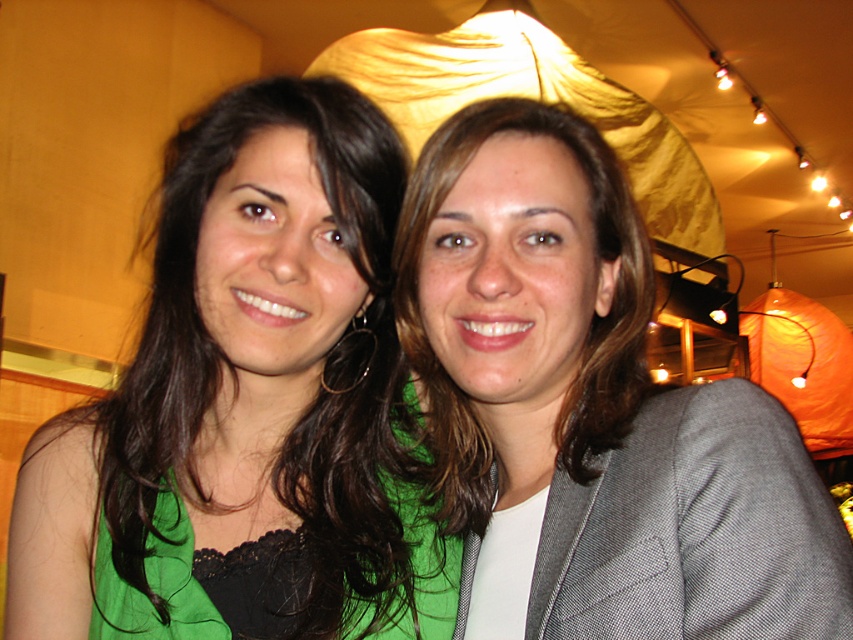
Who is more forward, (135, 355) or (587, 385)?

Point (587, 385)

Who is lower down, green fabric at left or matte gray blazer at center?

green fabric at left is lower down.

Between point (80, 588) and point (477, 481), which one is positioned in front?

Point (80, 588)

Identify the location of green fabric at left. This screenshot has height=640, width=853. (247, 406).

Can you confirm if green fabric at left is positioned to the right of green fabric jacket at upper right?

In fact, green fabric at left is to the left of green fabric jacket at upper right.

Who is lower down, green fabric at left or green fabric jacket at upper right?

green fabric jacket at upper right is below.

Between point (248, 252) and point (428, 140), which one is positioned in front?

Point (248, 252) is more forward.

Find the location of a particular element. The height and width of the screenshot is (640, 853). green fabric at left is located at coordinates (247, 406).

Is green fabric jacket at upper right below matte gray blazer at center?

Indeed, green fabric jacket at upper right is positioned under matte gray blazer at center.

Which is more to the right, green fabric jacket at upper right or matte gray blazer at center?

From the viewer's perspective, green fabric jacket at upper right appears more on the right side.

Does point (564, 401) come farther from viewer compared to point (561, 406)?

That is True.

Locate an element on the screen. green fabric jacket at upper right is located at coordinates (590, 410).